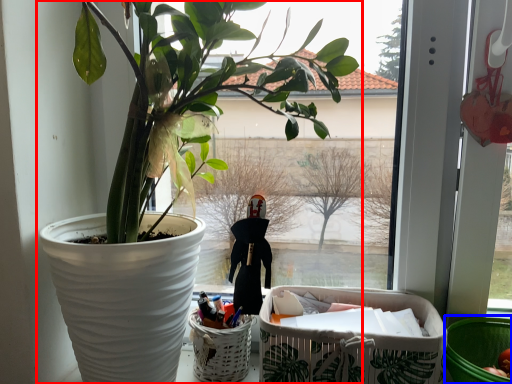
Question: Which point is further to the camera, houseplant (highlighted by a red box) or basket container (highlighted by a blue box)?

Choices:
 (A) houseplant
 (B) basket container

Answer: (B)